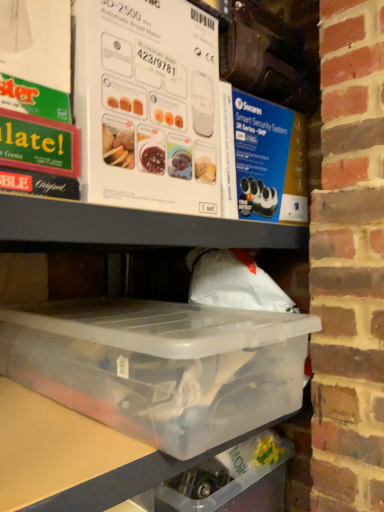
Question: Can you confirm if white cardboard box at upper center, positioned as the 1th box in top-to-bottom order, is positioned to the left of transparent plastic container at lower center, which is counted as the 2th box, starting from the top?

Choices:
 (A) no
 (B) yes

Answer: (B)

Question: Does white cardboard box at upper center, positioned as the 1th box in top-to-bottom order, have a greater height compared to transparent plastic container at lower center, which ranks as the 1th box in bottom-to-top order?

Choices:
 (A) no
 (B) yes

Answer: (B)

Question: Is white cardboard box at upper center, positioned as the 1th box in top-to-bottom order, positioned with its back to transparent plastic container at lower center, which ranks as the 1th box in bottom-to-top order?

Choices:
 (A) no
 (B) yes

Answer: (A)

Question: From the image's perspective, would you say white cardboard box at upper center, arranged as the 2th box when ordered from the bottom, is shown under transparent plastic container at lower center, which ranks as the 1th box in bottom-to-top order?

Choices:
 (A) no
 (B) yes

Answer: (A)

Question: Is white cardboard box at upper center, positioned as the 1th box in top-to-bottom order, beside transparent plastic container at lower center, which ranks as the 1th box in bottom-to-top order?

Choices:
 (A) yes
 (B) no

Answer: (B)

Question: Does white cardboard box at upper center, positioned as the 1th box in top-to-bottom order, appear on the right side of transparent plastic container at lower center, which ranks as the 1th box in bottom-to-top order?

Choices:
 (A) no
 (B) yes

Answer: (A)

Question: Is transparent plastic container at lower center, which ranks as the 1th box in bottom-to-top order, not close to white cardboard box at upper center, arranged as the 2th box when ordered from the bottom?

Choices:
 (A) yes
 (B) no

Answer: (B)

Question: From the image's perspective, is transparent plastic container at lower center, which is counted as the 2th box, starting from the top, on top of white cardboard box at upper center, positioned as the 1th box in top-to-bottom order?

Choices:
 (A) yes
 (B) no

Answer: (B)

Question: Is transparent plastic container at lower center, which ranks as the 1th box in bottom-to-top order, not within white cardboard box at upper center, positioned as the 1th box in top-to-bottom order?

Choices:
 (A) yes
 (B) no

Answer: (A)

Question: Considering the relative sizes of transparent plastic container at lower center, which is counted as the 2th box, starting from the top, and white cardboard box at upper center, positioned as the 1th box in top-to-bottom order, in the image provided, is transparent plastic container at lower center, which is counted as the 2th box, starting from the top, wider than white cardboard box at upper center, positioned as the 1th box in top-to-bottom order,?

Choices:
 (A) yes
 (B) no

Answer: (A)

Question: Is transparent plastic container at lower center, which is counted as the 2th box, starting from the top, taller than white cardboard box at upper center, positioned as the 1th box in top-to-bottom order?

Choices:
 (A) yes
 (B) no

Answer: (B)

Question: Considering the relative positions of transparent plastic container at lower center, which ranks as the 1th box in bottom-to-top order, and white cardboard box at upper center, arranged as the 2th box when ordered from the bottom, in the image provided, is transparent plastic container at lower center, which ranks as the 1th box in bottom-to-top order, to the right of white cardboard box at upper center, arranged as the 2th box when ordered from the bottom, from the viewer's perspective?

Choices:
 (A) no
 (B) yes

Answer: (B)

Question: In the image, is transparent plastic container at lower center, which ranks as the 1th box in bottom-to-top order, positioned in front of or behind white cardboard box at upper center, positioned as the 1th box in top-to-bottom order?

Choices:
 (A) front
 (B) behind

Answer: (A)